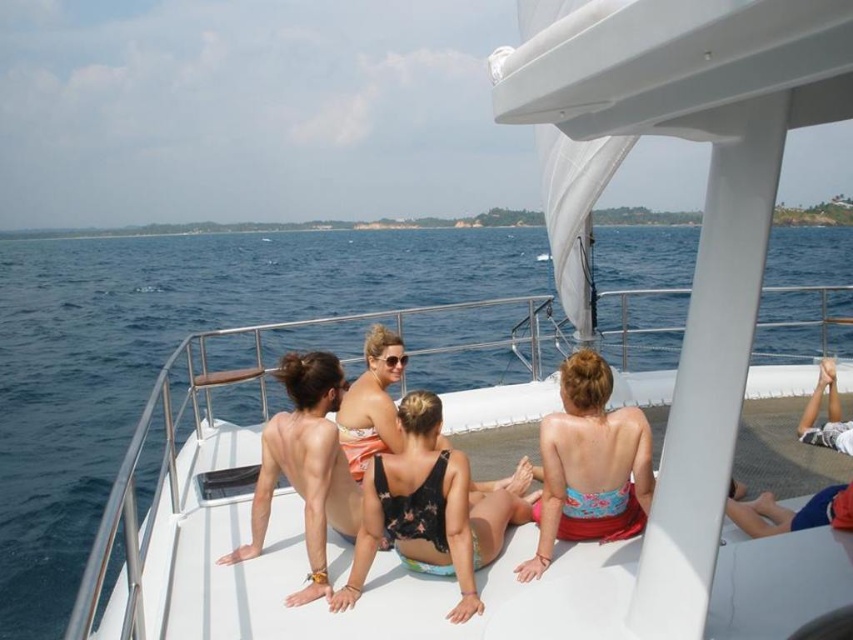
Is blue water at center below tan skin at center?

Incorrect, blue water at center is not positioned below tan skin at center.

Does blue water at center have a greater height compared to tan skin at center?

Yes, blue water at center is taller than tan skin at center.

What do you see at coordinates (167, 355) in the screenshot? The width and height of the screenshot is (853, 640). I see `blue water at center` at bounding box center [167, 355].

This screenshot has height=640, width=853. I want to click on blue water at center, so click(x=167, y=355).

In the scene shown: Is black floral swimsuit at center thinner than blue floral bikini top at center?

Incorrect, black floral swimsuit at center's width is not less than blue floral bikini top at center's.

Who is positioned more to the left, black floral swimsuit at center or blue floral bikini top at center?

black floral swimsuit at center is more to the left.

Describe the element at coordinates (428, 509) in the screenshot. This screenshot has height=640, width=853. I see `black floral swimsuit at center` at that location.

Where is `black floral swimsuit at center`? This screenshot has width=853, height=640. black floral swimsuit at center is located at coordinates (428, 509).

Is blue water at center above blue floral bikini top at center?

Correct, blue water at center is located above blue floral bikini top at center.

Locate an element on the screen. This screenshot has width=853, height=640. blue water at center is located at coordinates (167, 355).

Where is `blue water at center`? Image resolution: width=853 pixels, height=640 pixels. blue water at center is located at coordinates (167, 355).

You are a GUI agent. You are given a task and a screenshot of the screen. Output one action in this format:
    pyautogui.click(x=<x>, y=<y>)
    Task: Click on the blue water at center
    
    Given the screenshot: What is the action you would take?
    pyautogui.click(x=167, y=355)